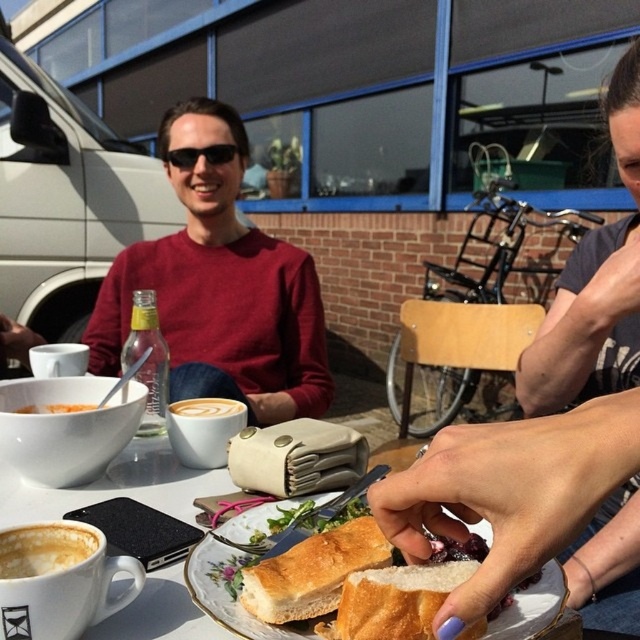
You are a barista trying to place the matte red sweater at center and latte art foam at center on the same table. Which object should you place first to ensure they both fit on the table?

The matte red sweater at center is much taller than the latte art foam at center, so you should place the taller matte red sweater at center first to ensure there is enough space for both items on the table.

You are a customer at the outdoor cafe and want to place your black plastic sunglasses at center on the table without moving the matte red sweater at center. Is there enough space to do this?

The matte red sweater at center is positioned under the black plastic sunglasses at center, so the sunglasses are already placed on top of the sweater. Therefore, there is no need to move the sweater to place the sunglasses as they are already positioned there.